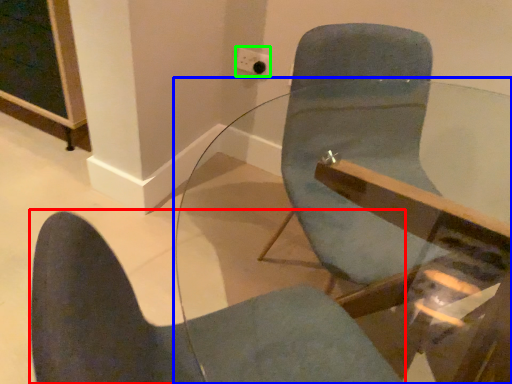
Question: Based on their relative distances, which object is nearer to chair (highlighted by a red box)? Choose from table (highlighted by a blue box) and electric outlet (highlighted by a green box).

Choices:
 (A) table
 (B) electric outlet

Answer: (A)